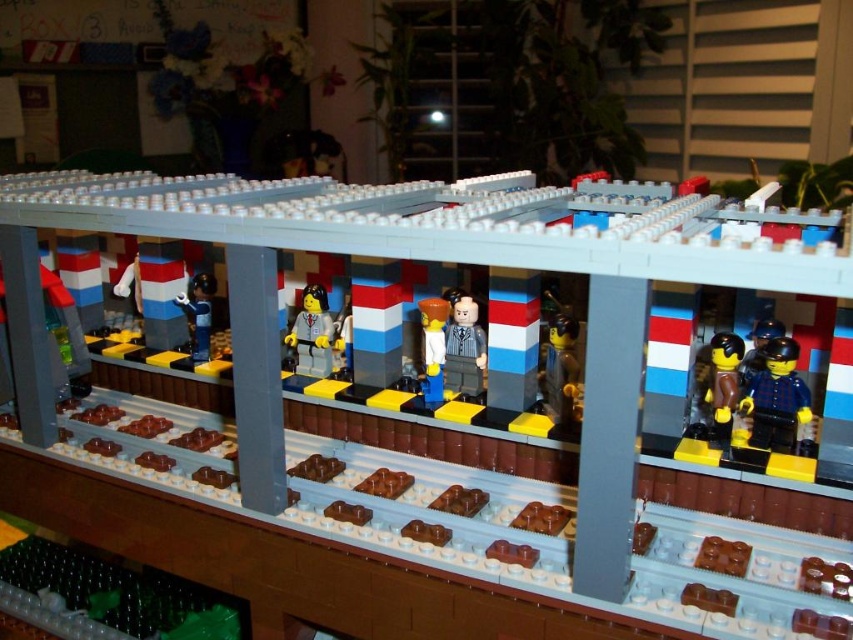
Question: Among these points, which one is farthest from the camera?

Choices:
 (A) (560, 316)
 (B) (735, 336)

Answer: (A)

Question: In this image, where is smooth brown minifigure at center located relative to smooth gray minifigure at center?

Choices:
 (A) right
 (B) left

Answer: (A)

Question: Among these points, which one is nearest to the camera?

Choices:
 (A) (323, 332)
 (B) (445, 337)

Answer: (B)

Question: Which object is the farthest from the smooth plastic train car at center?

Choices:
 (A) blue checkered shirt at right
 (B) smooth gray minifigure at center
 (C) translucent yellow plastic figure at center

Answer: (A)

Question: Does translucent yellow plastic figure at center have a smaller size compared to matte blue minifigure at left?

Choices:
 (A) no
 (B) yes

Answer: (B)

Question: Does brown matte minifigure at center-right appear on the left side of translucent yellow plastic figure at center?

Choices:
 (A) yes
 (B) no

Answer: (B)